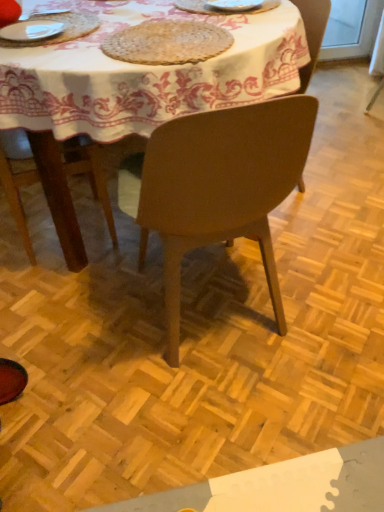
Where is `empty space that is to the right of matte brown chair at center, which ranks as the 1th chair in back-to-front order`? empty space that is to the right of matte brown chair at center, which ranks as the 1th chair in back-to-front order is located at coordinates (333, 175).